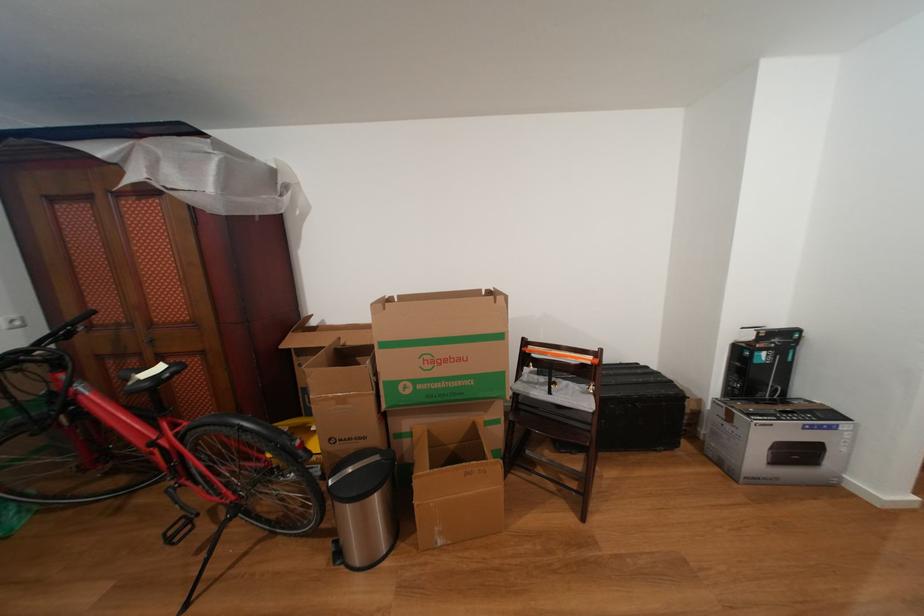
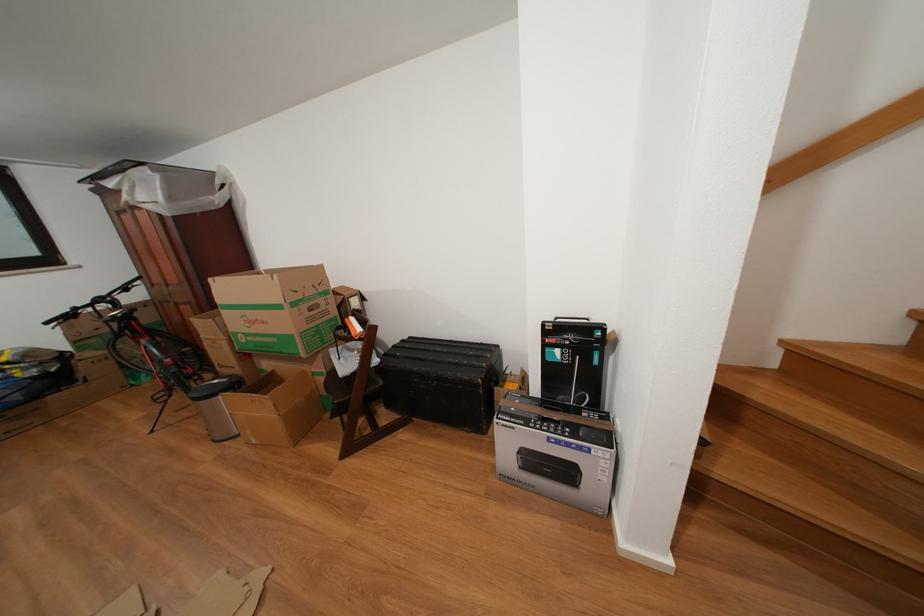
Find the pixel in the second image that matches [468,365] in the first image.

(272, 328)